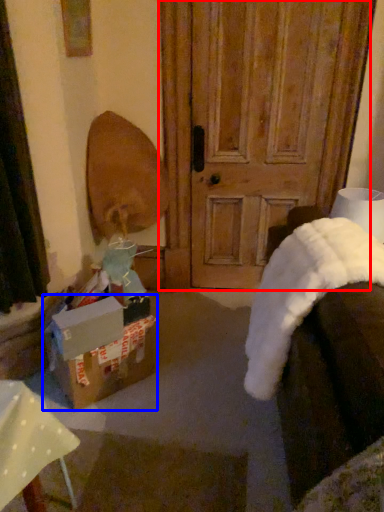
Question: Which object appears farthest to the camera in this image, door (highlighted by a red box) or box (highlighted by a blue box)?

Choices:
 (A) door
 (B) box

Answer: (A)